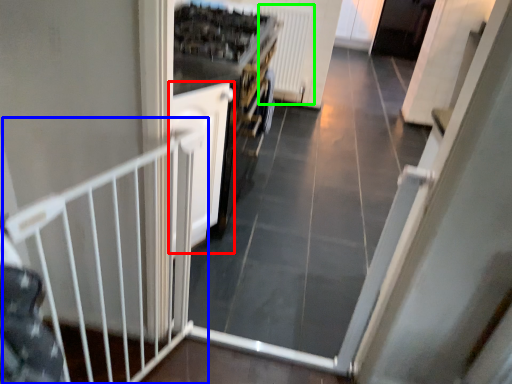
Question: Based on their relative distances, which object is farther from door (highlighted by a red box)? Choose from rail (highlighted by a blue box) and radiator (highlighted by a green box).

Choices:
 (A) rail
 (B) radiator

Answer: (B)